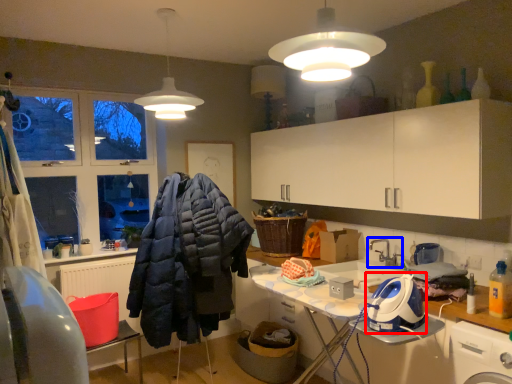
Question: Which of the following is the farthest to the observer, appliance (highlighted by a red box) or tap (highlighted by a blue box)?

Choices:
 (A) appliance
 (B) tap

Answer: (B)